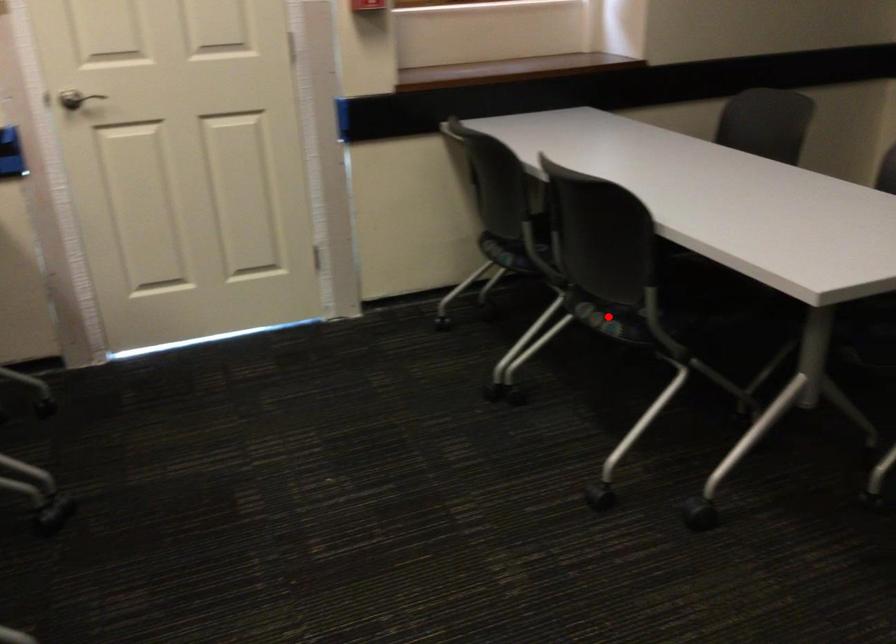
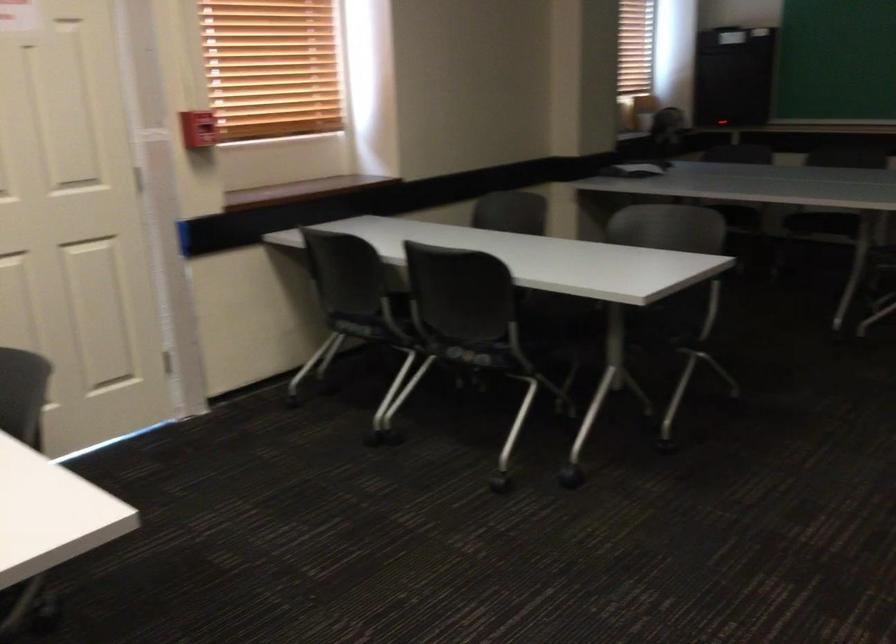
In the second image, find the point that corresponds to the highlighted location in the first image.

(474, 354)